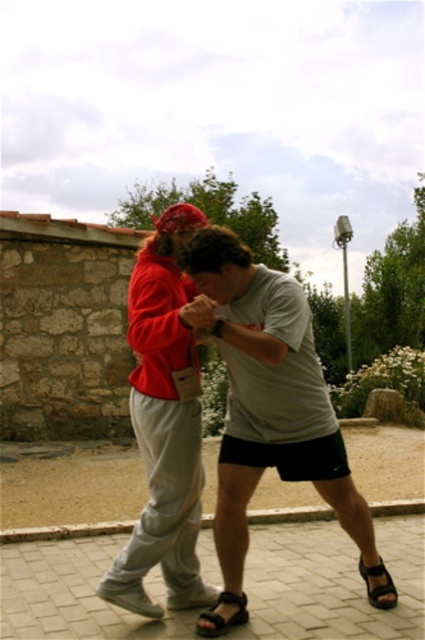
You are a photographer trying to capture the best shot of the two points marked in the image. Which point, point (x=201, y=627) or point (x=367, y=566), is positioned closer to your camera lens?

Point (x=201, y=627) is closer to the camera than point (x=367, y=566), so it will appear larger in the photograph.